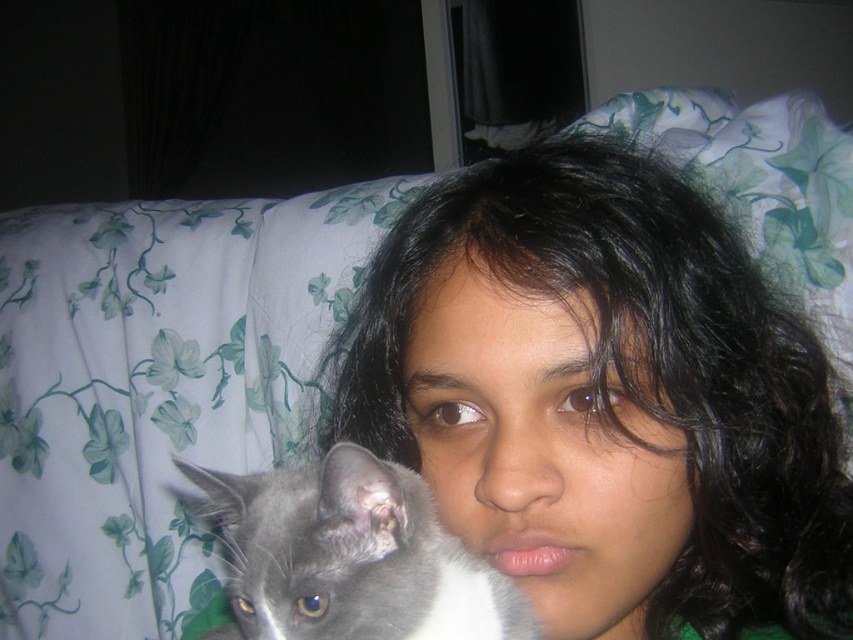
Is black matte hair at center thinner than gray soft fur cat at lower left?

No.

Between point (498, 240) and point (410, 492), which one is positioned behind?

The point (498, 240) is more distant.

Locate an element on the screen. This screenshot has width=853, height=640. black matte hair at center is located at coordinates (605, 397).